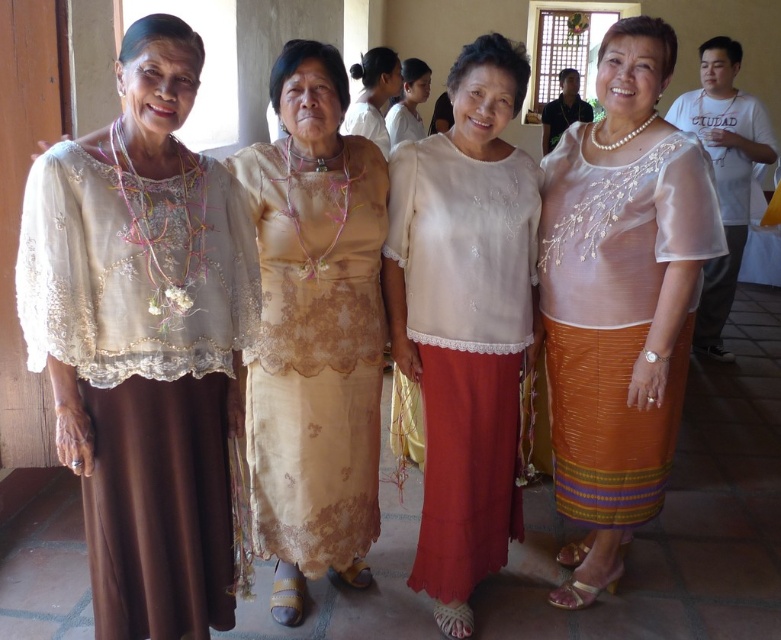
Question: Where is pearl white sheer blouse at upper right located in relation to white sheer blouse at upper center in the image?

Choices:
 (A) left
 (B) right

Answer: (B)

Question: Which point is closer to the camera?

Choices:
 (A) (619, 385)
 (B) (507, 326)
 (C) (144, 237)
 (D) (708, 152)

Answer: (C)

Question: Which of these objects is positioned closest to the white sheer blouse at upper center?

Choices:
 (A) matte brown dress at left
 (B) beige lace dress at center
 (C) light beige lace blouse at center
 (D) pearl white sheer blouse at upper right

Answer: (C)

Question: Which point appears closest to the camera in this image?

Choices:
 (A) (726, 74)
 (B) (480, 566)
 (C) (373, 92)
 (D) (571, 86)

Answer: (B)

Question: Is beige lace dress at center bigger than light beige lace blouse at center?

Choices:
 (A) no
 (B) yes

Answer: (A)

Question: Is matte brown dress at left positioned before pearl necklace at upper center?

Choices:
 (A) yes
 (B) no

Answer: (A)